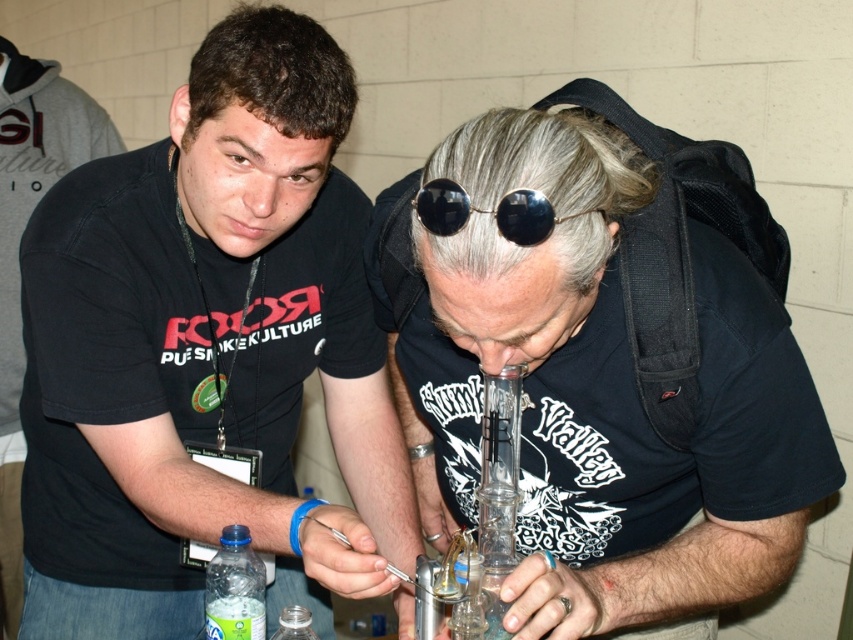
Is clear glass pipe at center further to camera compared to clear plastic bottle at lower left?

No.

Consider the image. Which of these two, clear glass pipe at center or clear plastic bottle at lower left, stands shorter?

clear plastic bottle at lower left

Identify the location of clear glass pipe at center. (593, 385).

Can you confirm if clear glass pipe at center is shorter than black reflective sunglasses at center?

No.

Can you confirm if clear glass pipe at center is positioned above black reflective sunglasses at center?

No, clear glass pipe at center is not above black reflective sunglasses at center.

The image size is (853, 640). In order to click on clear glass pipe at center in this screenshot , I will do `click(593, 385)`.

This screenshot has width=853, height=640. I want to click on clear glass pipe at center, so click(593, 385).

Is transparent glass bong at center below clear plastic bottle at lower left?

No, transparent glass bong at center is not below clear plastic bottle at lower left.

The width and height of the screenshot is (853, 640). In order to click on transparent glass bong at center in this screenshot , I will do `click(498, 490)`.